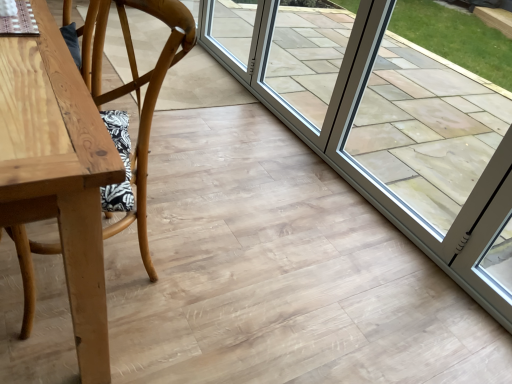
What do you see at coordinates (150, 104) in the screenshot? I see `wooden chair at left` at bounding box center [150, 104].

The width and height of the screenshot is (512, 384). Identify the location of wooden chair at left. (150, 104).

Identify the location of transparent glass door at right. This screenshot has width=512, height=384. (386, 128).

Describe the element at coordinates (307, 58) in the screenshot. I see `clear glass door at center` at that location.

Where is `wooden chair at left`? The image size is (512, 384). wooden chair at left is located at coordinates (150, 104).

How different are the orientations of wooden chair at left and transparent glass door at right in degrees?

The angular difference between wooden chair at left and transparent glass door at right is 2.87 degrees.

Is wooden chair at left placed right next to transparent glass door at right?

No, wooden chair at left is not beside transparent glass door at right.

Is wooden chair at left behind transparent glass door at right?

No, it is not.

Find the location of `door above the wooden chair at left (from the image's perspective)`. door above the wooden chair at left (from the image's perspective) is located at coordinates (386, 128).

Can you confirm if clear glass door at center is taller than wooden chair at left?

No.

In the scene shown: Does clear glass door at center have a larger size compared to wooden chair at left?

No, clear glass door at center is not bigger than wooden chair at left.

Looking at this image, considering the positions of objects clear glass door at center and wooden chair at left in the image provided, who is more to the left, clear glass door at center or wooden chair at left?

wooden chair at left.

How different are the orientations of transparent glass door at right and clear glass door at center in degrees?

transparent glass door at right and clear glass door at center are facing 0.141 degrees away from each other.

Is the surface of transparent glass door at right in direct contact with clear glass door at center?

There is a gap between transparent glass door at right and clear glass door at center.

Could you tell me if transparent glass door at right is turned towards clear glass door at center?

No, transparent glass door at right is not aimed at clear glass door at center.

Considering the relative sizes of transparent glass door at right and clear glass door at center in the image provided, is transparent glass door at right bigger than clear glass door at center?

Correct, transparent glass door at right is larger in size than clear glass door at center.

Which of these two, wooden chair at left or clear glass door at center, is wider?

wooden chair at left.

Which of these two, wooden chair at left or clear glass door at center, stands taller?

wooden chair at left is taller.

In the scene shown: Does wooden chair at left touch clear glass door at center?

There is a gap between wooden chair at left and clear glass door at center.

In the scene shown: Which is correct: wooden chair at left is inside clear glass door at center, or outside of it?

wooden chair at left is not inside clear glass door at center, it's outside.

Identify the location of door above the wooden chair at left (from the image's perspective). (386, 128).

Is transparent glass door at right not within wooden chair at left?

transparent glass door at right lies outside wooden chair at left's area.

From the image's perspective, is transparent glass door at right located above or below wooden chair at left?

transparent glass door at right is above wooden chair at left.

Does transparent glass door at right come in front of wooden chair at left?

That is False.

Can you confirm if clear glass door at center is wider than transparent glass door at right?

Yes, clear glass door at center is wider than transparent glass door at right.

Based on their positions, is clear glass door at center located to the left or right of transparent glass door at right?

clear glass door at center is positioned on transparent glass door at right's left side.

Locate an element on the screen. window below the transparent glass door at right (from a real-world perspective) is located at coordinates (307, 58).

Looking at this image, considering the relative sizes of clear glass door at center and transparent glass door at right in the image provided, is clear glass door at center bigger than transparent glass door at right?

No.

I want to click on chair to the left of transparent glass door at right, so click(150, 104).

Where is `window beneath the wooden chair at left (from a real-world perspective)`? window beneath the wooden chair at left (from a real-world perspective) is located at coordinates (307, 58).

Looking at the image, which one is located closer to transparent glass door at right, clear glass door at center or wooden chair at left?

Among the two, clear glass door at center is located nearer to transparent glass door at right.

Considering their positions, is transparent glass door at right positioned closer to wooden chair at left than clear glass door at center?

transparent glass door at right is closer to wooden chair at left.

When comparing their distances from wooden chair at left, does clear glass door at center or transparent glass door at right seem closer?

transparent glass door at right is closer to wooden chair at left.

Looking at the image, which one is located closer to clear glass door at center, wooden chair at left or transparent glass door at right?

Based on the image, transparent glass door at right appears to be nearer to clear glass door at center.

Which object lies nearer to the anchor point transparent glass door at right, wooden chair at left or clear glass door at center?

Among the two, clear glass door at center is located nearer to transparent glass door at right.

Considering their positions, is transparent glass door at right positioned further to clear glass door at center than wooden chair at left?

Based on the image, wooden chair at left appears to be further to clear glass door at center.

Image resolution: width=512 pixels, height=384 pixels. What are the coordinates of `window between wooden chair at left and transparent glass door at right from left to right` in the screenshot? It's located at point(307,58).